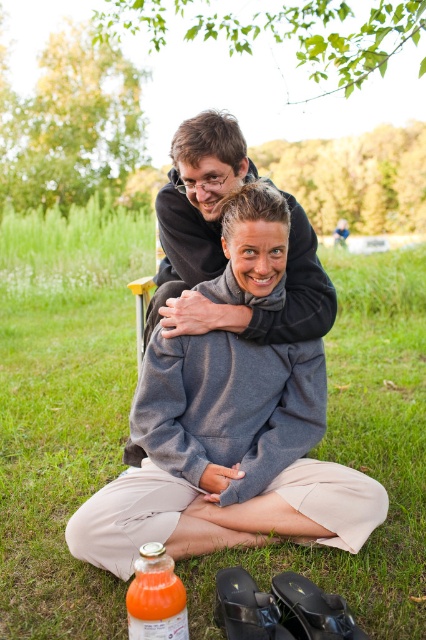
Question: Which point is closer to the camera?

Choices:
 (A) (x=48, y=241)
 (B) (x=233, y=125)
 (C) (x=149, y=592)
 (D) (x=138, y=566)

Answer: (C)

Question: Among these points, which one is farthest from the camera?

Choices:
 (A) (166, 586)
 (B) (184, 314)

Answer: (B)

Question: Is black soft sweatshirt at center closer to the viewer compared to translucent plastic bottle at lower center?

Choices:
 (A) no
 (B) yes

Answer: (A)

Question: Considering the relative positions of green grass at center and translucent plastic bottle at lower center in the image provided, where is green grass at center located with respect to translucent plastic bottle at lower center?

Choices:
 (A) below
 (B) above

Answer: (B)

Question: Which point is farther to the camera?

Choices:
 (A) (184, 592)
 (B) (377, 614)
 (C) (160, 593)
 (D) (307, 227)

Answer: (D)

Question: Is green grass at center behind translucent plastic bottle at lower center?

Choices:
 (A) yes
 (B) no

Answer: (A)